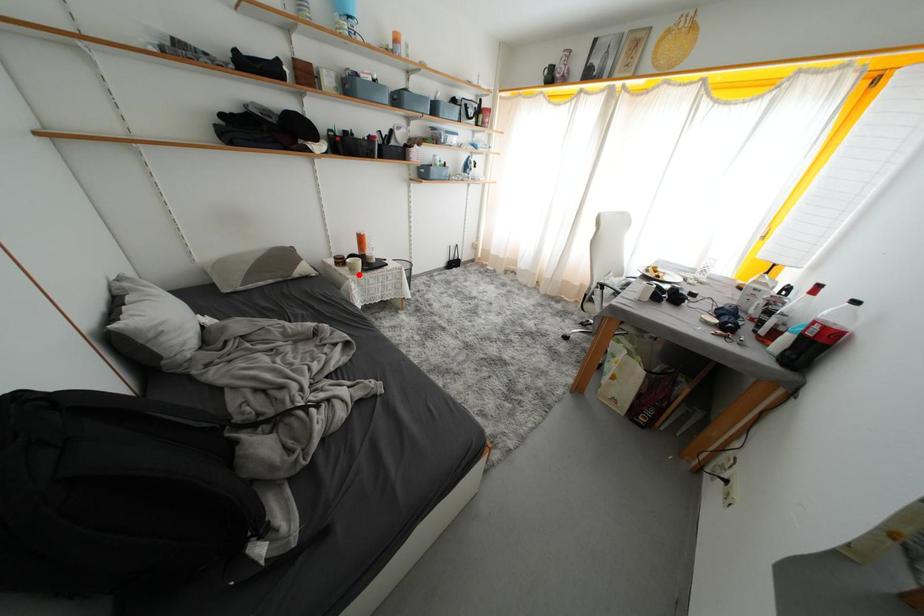
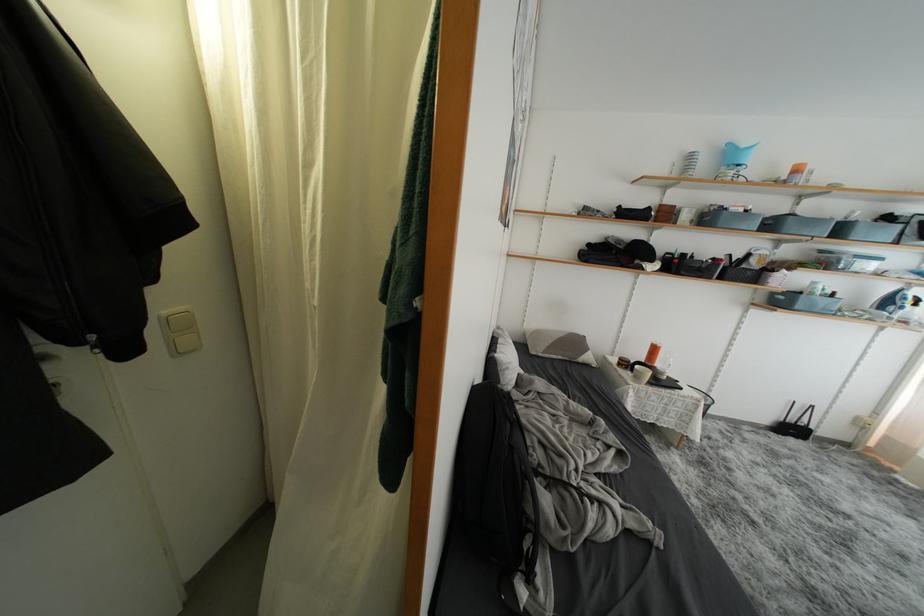
Question: I am providing you with two images of the same scene from different viewpoints. In image1, a red point is highlighted. Considering the same 3D point in image2, which of the following is correct?

Choices:
 (A) It is closer
 (B) It is farther

Answer: (B)